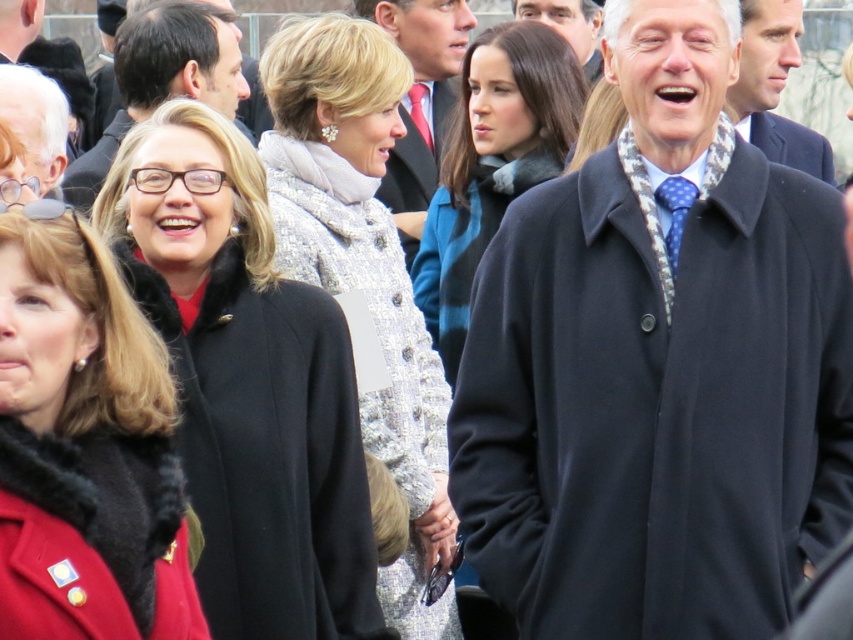
Question: Can you confirm if light gray textured coat at center is wider than polka dot silk tie at center?

Choices:
 (A) no
 (B) yes

Answer: (B)

Question: Which of the following is the closest to the observer?

Choices:
 (A) (173, 538)
 (B) (427, 65)
 (C) (366, 198)
 (D) (215, 20)

Answer: (A)

Question: Does silver textured coat at center appear on the right side of dark blue suit at center?

Choices:
 (A) yes
 (B) no

Answer: (B)

Question: Which object appears closest to the camera in this image?

Choices:
 (A) black wool coat at center
 (B) matte black coat at center

Answer: (A)

Question: Can you confirm if light gray textured coat at center is smaller than polka dot silk tie at center?

Choices:
 (A) no
 (B) yes

Answer: (A)

Question: Based on their relative distances, which object is farther from the dark blue suit at center?

Choices:
 (A) light gray textured coat at center
 (B) silver textured coat at center

Answer: (B)